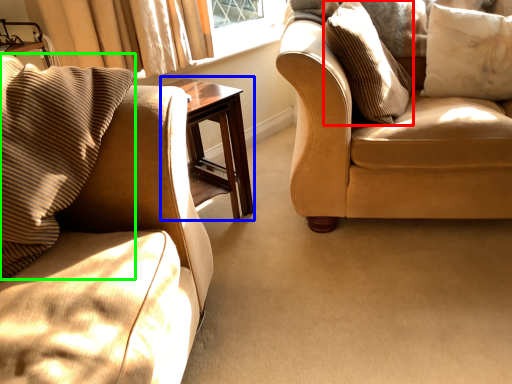
Question: Estimate the real-world distances between objects in this image. Which object is farther from pillow (highlighted by a red box), table (highlighted by a blue box) or pillow (highlighted by a green box)?

Choices:
 (A) table
 (B) pillow

Answer: (B)